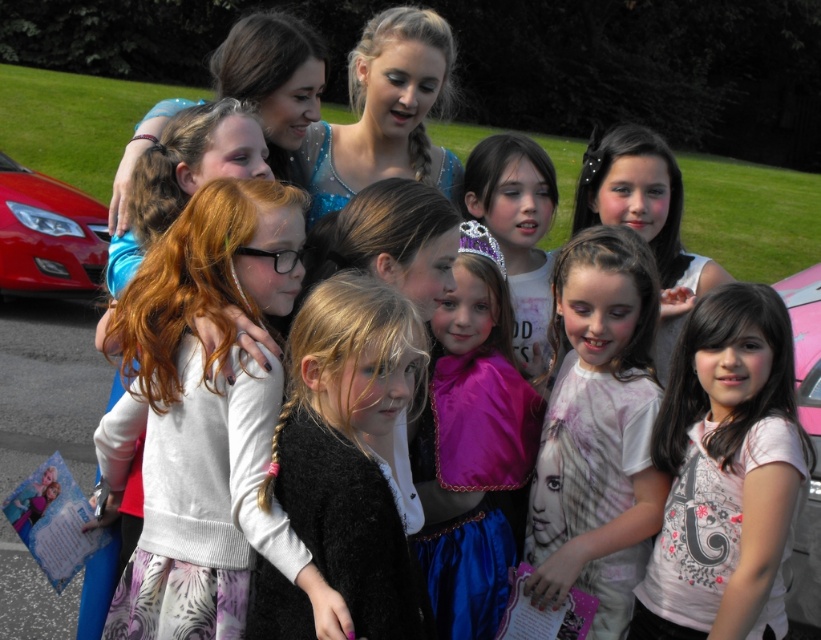
Question: Among these points, which one is farthest from the camera?

Choices:
 (A) (314, 573)
 (B) (416, 152)
 (C) (576, 268)

Answer: (B)

Question: Can you confirm if white printed shirt at center is thinner than shiny red car at left?

Choices:
 (A) no
 (B) yes

Answer: (B)

Question: Is the position of matte pink dress at center less distant than that of pink metallic car at lower right?

Choices:
 (A) no
 (B) yes

Answer: (B)

Question: Which point is farther to the camera?

Choices:
 (A) (172, 291)
 (B) (443, 192)
 (C) (471, 269)
 (D) (618, 157)

Answer: (B)

Question: Which point is closer to the camera taking this photo?

Choices:
 (A) (35, 230)
 (B) (310, 132)
 (C) (576, 220)
 (D) (466, 369)

Answer: (D)

Question: Is white printed shirt at center above purple satin dress at center?

Choices:
 (A) no
 (B) yes

Answer: (A)